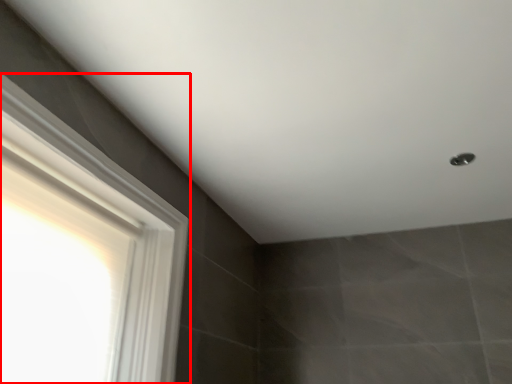
Question: Observing the image, what is the correct spatial positioning of window (annotated by the red box) in reference to shower?

Choices:
 (A) left
 (B) right

Answer: (A)